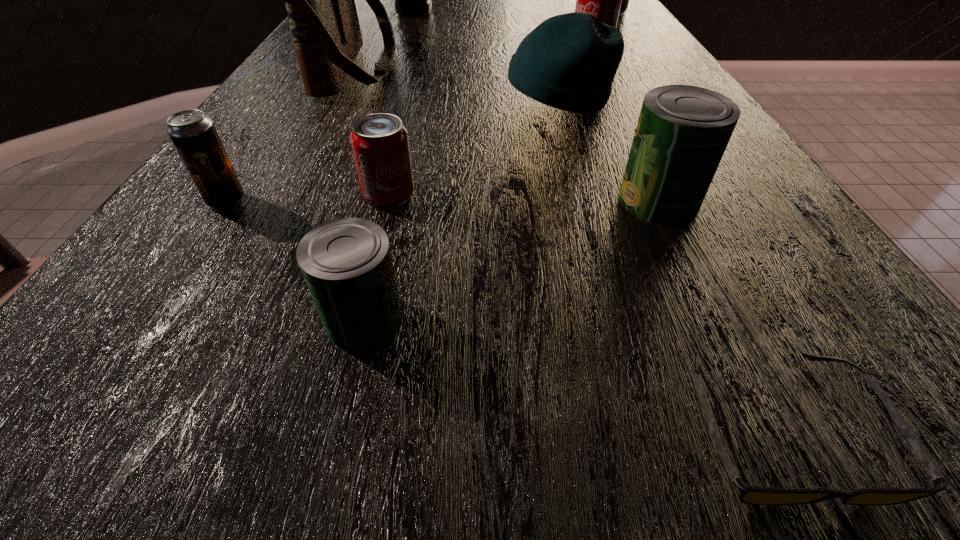
Where is `black liquor`? Image resolution: width=960 pixels, height=540 pixels. black liquor is located at coordinates (410, 0).

This screenshot has height=540, width=960. I want to click on the tallest object, so click(410, 0).

At what (x,y) coordinates should I click in order to perform the action: click on shoulder bag. Please return your answer as a coordinate pair (x, y). The height and width of the screenshot is (540, 960). Looking at the image, I should click on (319, 0).

Where is `the farthest can`? The width and height of the screenshot is (960, 540). the farthest can is located at coordinates (625, 0).

Image resolution: width=960 pixels, height=540 pixels. I want to click on the biggest red can, so click(x=625, y=0).

Locate an element on the screen. This screenshot has width=960, height=540. beanie is located at coordinates (569, 61).

The image size is (960, 540). What are the coordinates of `the second biggest red can` in the screenshot? It's located at (603, 0).

Locate an element on the screen. This screenshot has width=960, height=540. the second farthest can is located at coordinates point(603,0).

Find the location of a particular element. Image resolution: width=960 pixels, height=540 pixels. the bigger green can is located at coordinates (682, 132).

Identify the location of the farther green can. Image resolution: width=960 pixels, height=540 pixels. (682, 132).